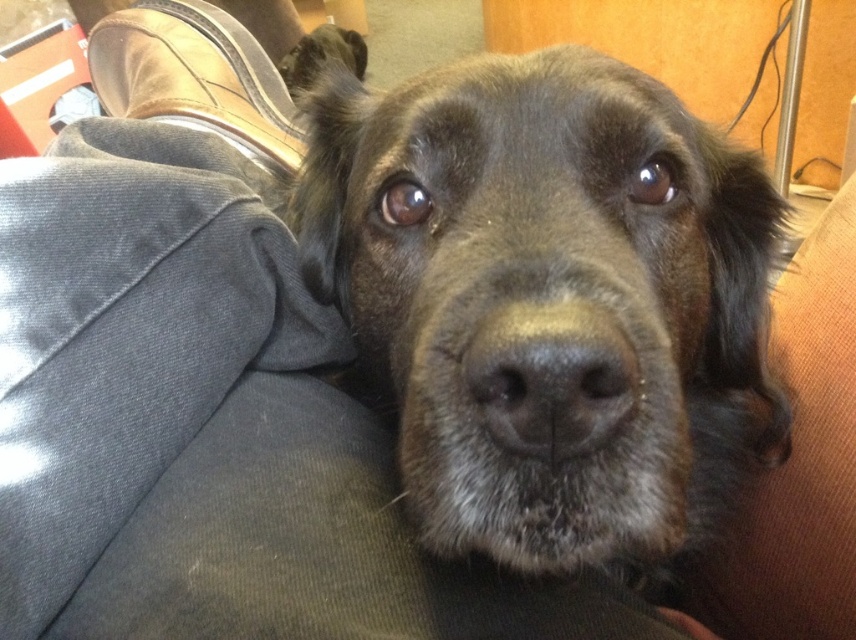
Question: Among these points, which one is farthest from the camera?

Choices:
 (A) (591, 392)
 (B) (480, 212)

Answer: (B)

Question: Which object appears closest to the camera in this image?

Choices:
 (A) shiny black fur at center
 (B) black matte nose at center

Answer: (A)

Question: Can you confirm if shiny black fur at center is thinner than black matte nose at center?

Choices:
 (A) no
 (B) yes

Answer: (A)

Question: Is shiny black fur at center to the left of black matte nose at center from the viewer's perspective?

Choices:
 (A) yes
 (B) no

Answer: (B)

Question: Can you confirm if shiny black fur at center is positioned above black matte nose at center?

Choices:
 (A) yes
 (B) no

Answer: (A)

Question: Which of the following is the farthest from the observer?

Choices:
 (A) (525, 285)
 (B) (482, 330)

Answer: (A)